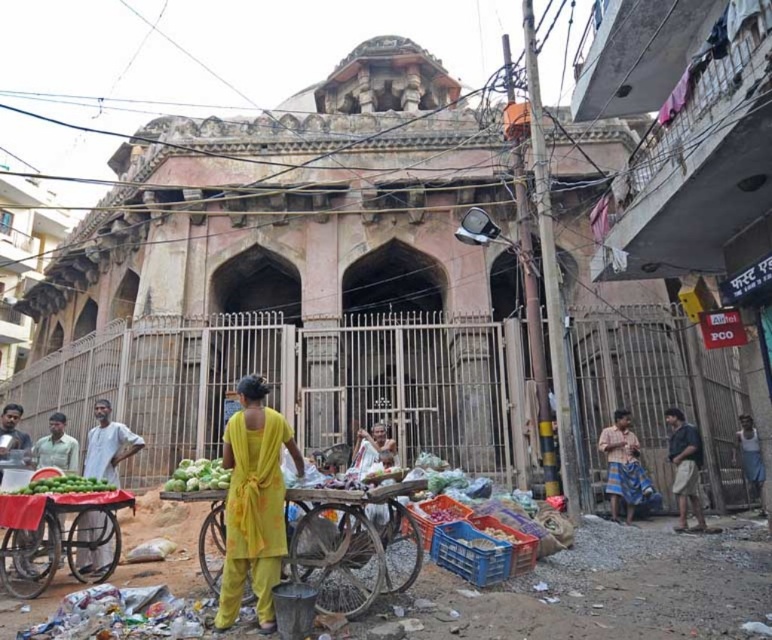
Question: Which point is farther to the camera?

Choices:
 (A) (180, 460)
 (B) (208, 566)
 (C) (56, 548)

Answer: (A)

Question: Can you confirm if yellow fabric cart at center is positioned to the right of green matte cabbage at center?

Choices:
 (A) yes
 (B) no

Answer: (A)

Question: Can you confirm if yellow fabric cart at center is thinner than light gray cotton shirt at lower left?

Choices:
 (A) yes
 (B) no

Answer: (B)

Question: Which point is closer to the camera?

Choices:
 (A) light gray cotton shirt at lower left
 (B) green fabric cart at lower left

Answer: (B)

Question: Which of the following is the closest to the observer?

Choices:
 (A) (76, 484)
 (B) (644, 496)
 (C) (219, 477)

Answer: (C)

Question: Can you confirm if dark green fabric at right is bigger than green matte cabbage at center?

Choices:
 (A) yes
 (B) no

Answer: (B)